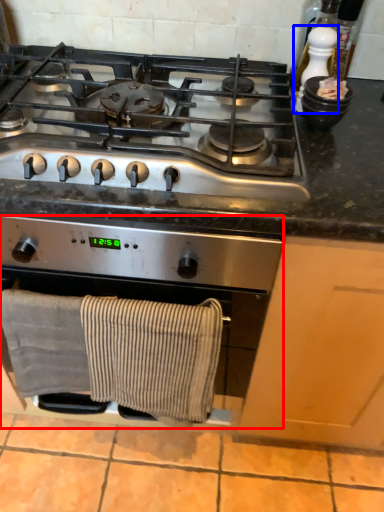
Question: Which point is closer to the camera, kitchen appliance (highlighted by a red box) or appliance (highlighted by a blue box)?

Choices:
 (A) kitchen appliance
 (B) appliance

Answer: (A)